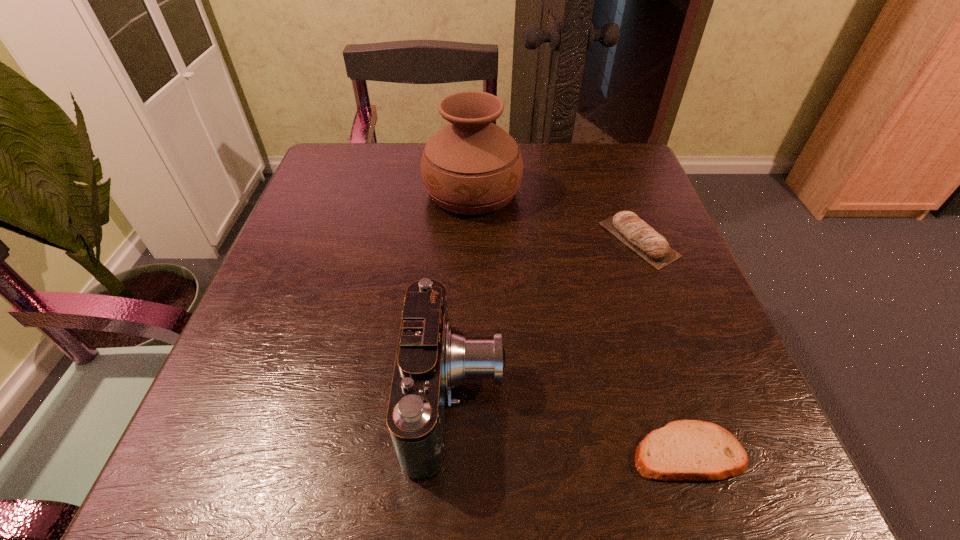
Locate an element on the screen. This screenshot has width=960, height=540. urn is located at coordinates (471, 166).

This screenshot has height=540, width=960. I want to click on the second tallest object, so [x=432, y=358].

What are the coordinates of `the taller pita bread` in the screenshot? It's located at (645, 241).

Where is `the farther pita bread`? The width and height of the screenshot is (960, 540). the farther pita bread is located at coordinates (645, 241).

The height and width of the screenshot is (540, 960). What are the coordinates of `the shorter pita bread` in the screenshot? It's located at (685, 450).

The height and width of the screenshot is (540, 960). In order to click on the nearer pita bread in this screenshot , I will do `click(685, 450)`.

Where is `blank space located on the right of the urn`? The image size is (960, 540). blank space located on the right of the urn is located at coordinates (646, 192).

Where is `vacant space located on the front-facing side of the camcorder`? The height and width of the screenshot is (540, 960). vacant space located on the front-facing side of the camcorder is located at coordinates (553, 396).

The height and width of the screenshot is (540, 960). I want to click on free space located 0.180m on the left of the taller pita bread, so click(x=513, y=240).

The width and height of the screenshot is (960, 540). I want to click on vacant space located 0.280m on the back of the nearer pita bread, so click(631, 279).